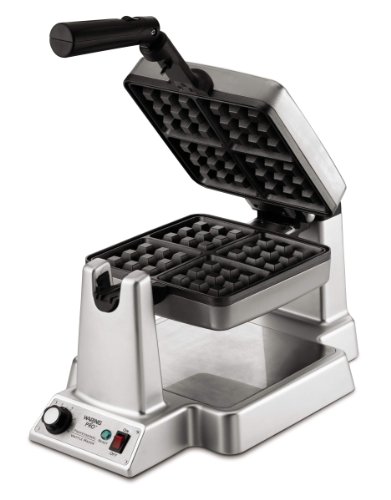
Where is `white circle in th knob`? The height and width of the screenshot is (500, 391). white circle in th knob is located at coordinates (x=50, y=419).